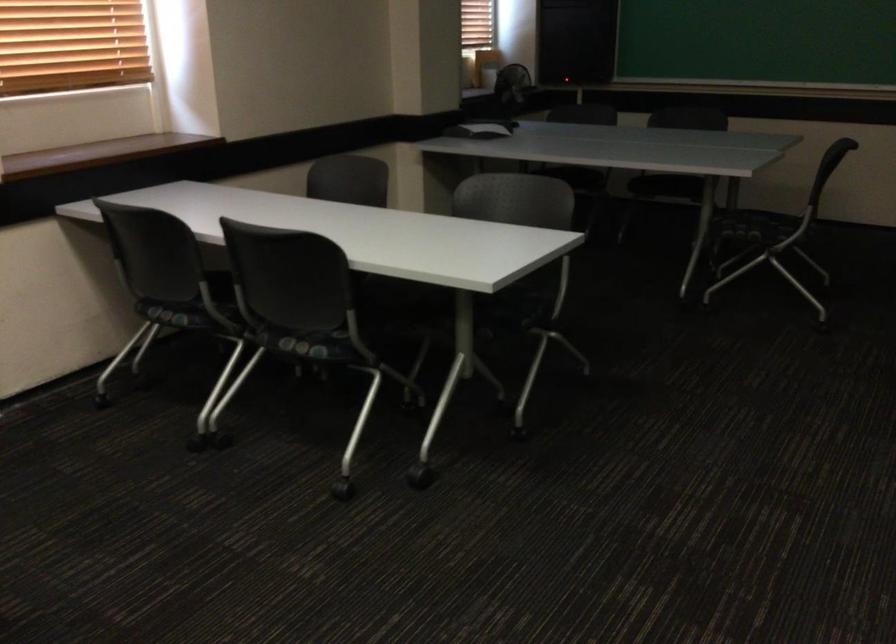
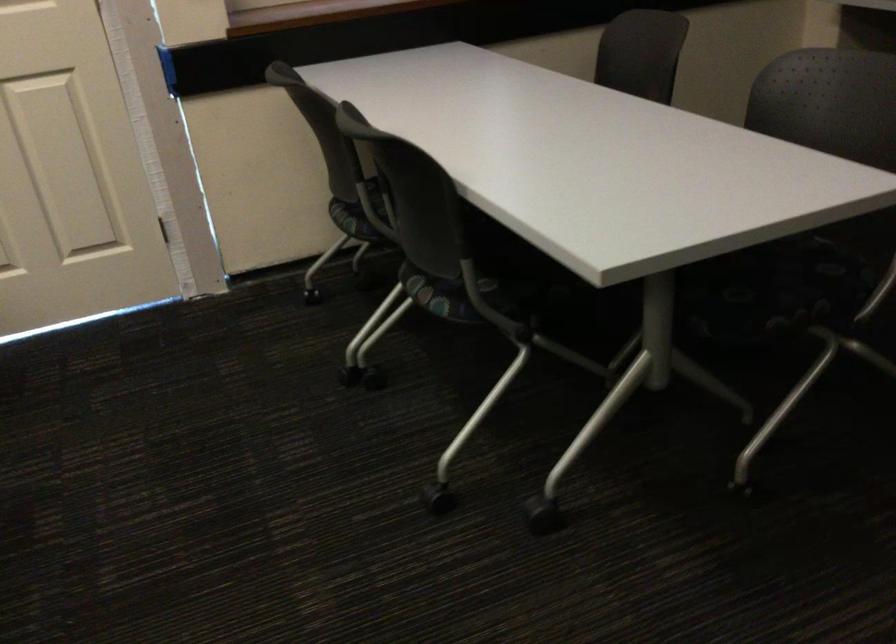
Where in the second image is the point corresponding to [513,327] from the first image?

(748, 326)